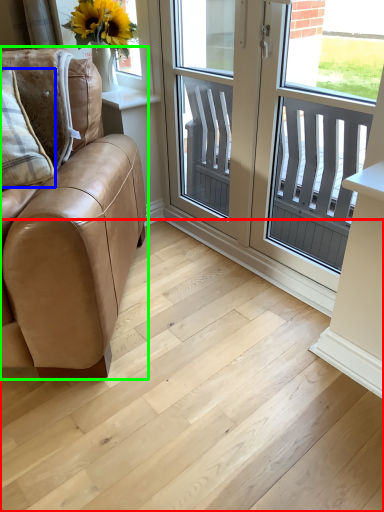
Question: Based on their relative distances, which object is farther from stairwell (highlighted by a red box)? Choose from pillow (highlighted by a blue box) and studio couch (highlighted by a green box).

Choices:
 (A) pillow
 (B) studio couch

Answer: (A)